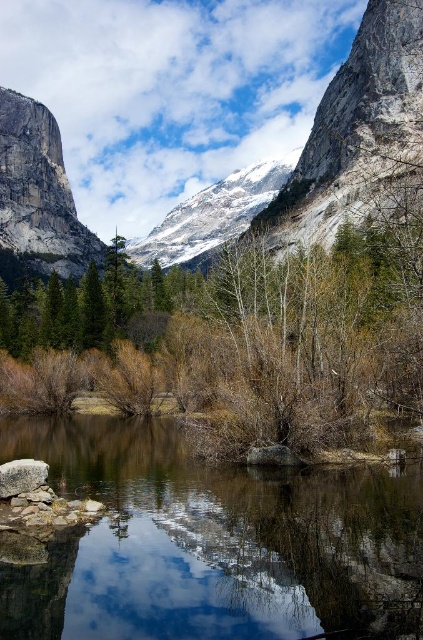
Question: Can you confirm if clear water at center is thinner than gray rough stone at lower left?

Choices:
 (A) yes
 (B) no

Answer: (B)

Question: Considering the relative positions of clear water at center and gray rough stone at lower left in the image provided, where is clear water at center located with respect to gray rough stone at lower left?

Choices:
 (A) above
 (B) below

Answer: (B)

Question: Which of the following is the farthest from the observer?

Choices:
 (A) green matte tree at center
 (B) gray stone mountain at center
 (C) gray rough stone at lower left

Answer: (A)

Question: Which object is closer to the camera taking this photo?

Choices:
 (A) gray rough stone at lower left
 (B) gray stone mountain at center
 (C) clear water at center
 (D) green matte tree at center

Answer: (C)

Question: Among these objects, which one is nearest to the camera?

Choices:
 (A) green matte tree at center
 (B) gray rough stone at lower left
 (C) clear water at center

Answer: (C)

Question: Is clear water at center below gray rough stone at lower left?

Choices:
 (A) yes
 (B) no

Answer: (A)